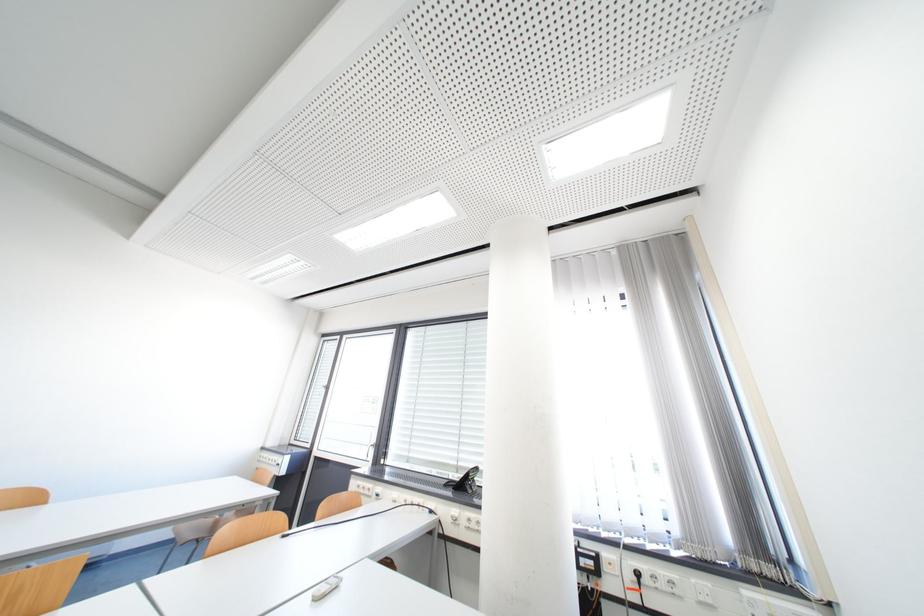
This screenshot has height=616, width=924. I want to click on white light switch, so click(701, 592).